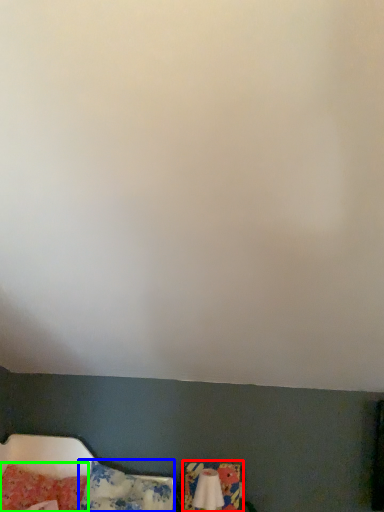
Question: Considering the real-world distances, which object is closest to swivel chair (highlighted by a red box)? pillow (highlighted by a blue box) or pillow (highlighted by a green box).

Choices:
 (A) pillow
 (B) pillow

Answer: (A)